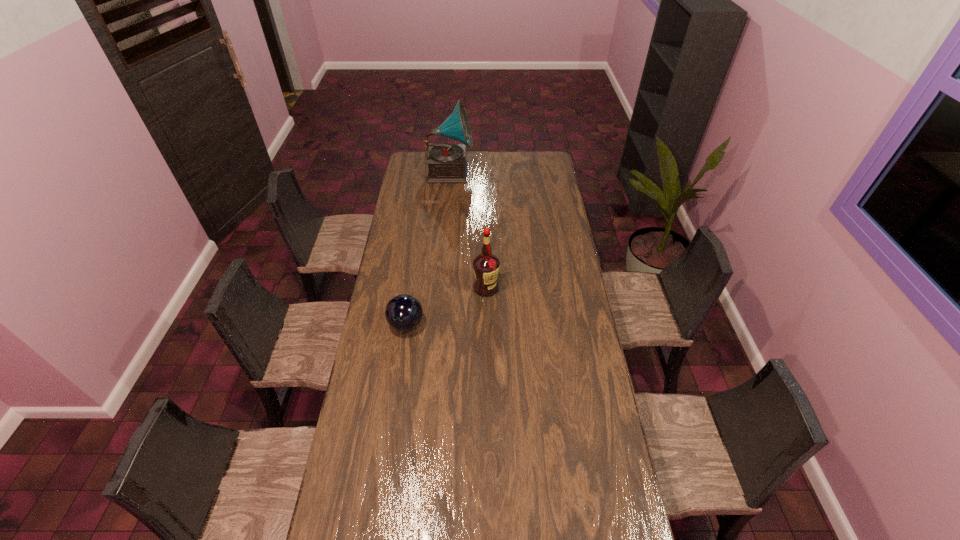
I want to click on record player that is at the left edge, so click(446, 162).

At what (x,y) coordinates should I click in order to perform the action: click on bowling ball positioned at the left edge. Please return your answer as a coordinate pair (x, y). Looking at the image, I should click on coord(404,312).

Locate an element on the screen. This screenshot has width=960, height=540. object at the far left corner is located at coordinates (446, 162).

You are a GUI agent. You are given a task and a screenshot of the screen. Output one action in this format:
    pyautogui.click(x=<x>, y=<y>)
    Task: Click on the vacant space at the far edge of the desktop
    
    Given the screenshot: What is the action you would take?
    pyautogui.click(x=471, y=161)

Where is `vacant space at the left edge`? The image size is (960, 540). vacant space at the left edge is located at coordinates (346, 492).

Find the location of a particular element. This screenshot has height=540, width=960. vacant region at the right edge of the desktop is located at coordinates (598, 509).

This screenshot has width=960, height=540. What are the coordinates of `vacant area that lies between the alcohol and the bowling ball` in the screenshot? It's located at (446, 306).

The height and width of the screenshot is (540, 960). In order to click on free spot between the second farthest object and the nearest object in this screenshot , I will do `click(446, 306)`.

Find the location of a particular element. The width and height of the screenshot is (960, 540). free space between the farthest object and the second farthest object is located at coordinates (468, 230).

Image resolution: width=960 pixels, height=540 pixels. What are the coordinates of `vacant region between the shortest object and the farthest object` in the screenshot? It's located at (428, 248).